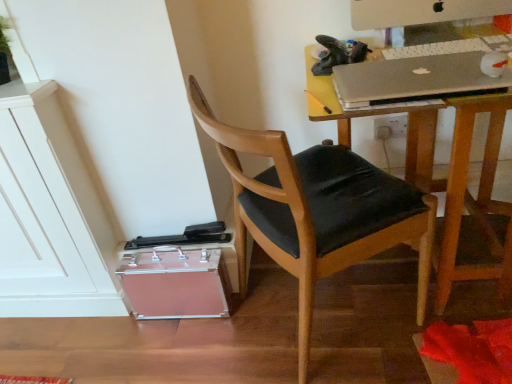
Locate an element on the screen. blank area beneath wooden chair with black cushion at center (from a real-world perspective) is located at coordinates (297, 314).